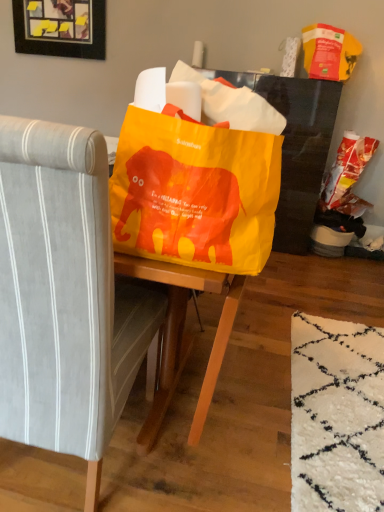
At what (x,y) coordinates should I click in order to perform the action: click on free location to the right of gray fabric chair at center. Please return your answer as a coordinate pair (x, y). Looking at the image, I should click on (202, 446).